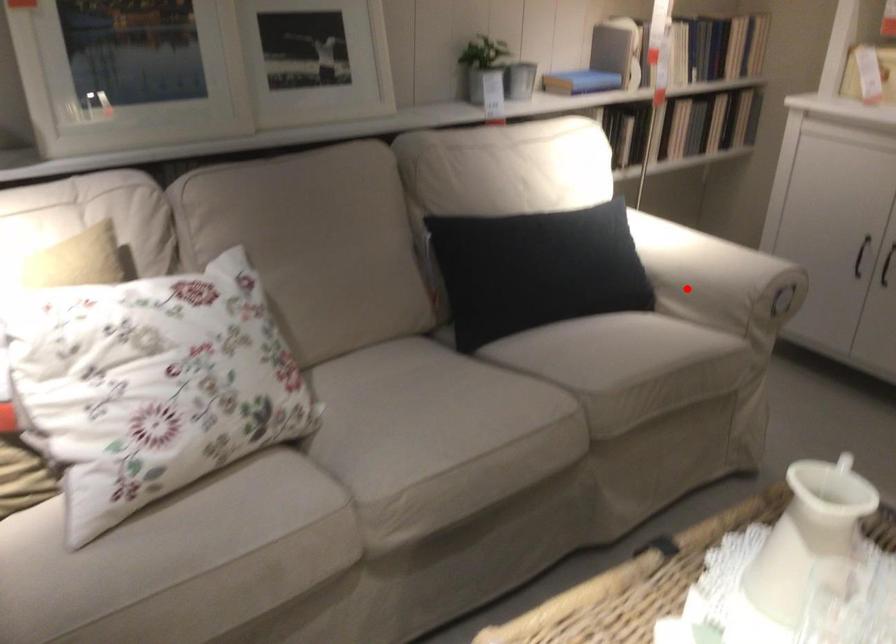
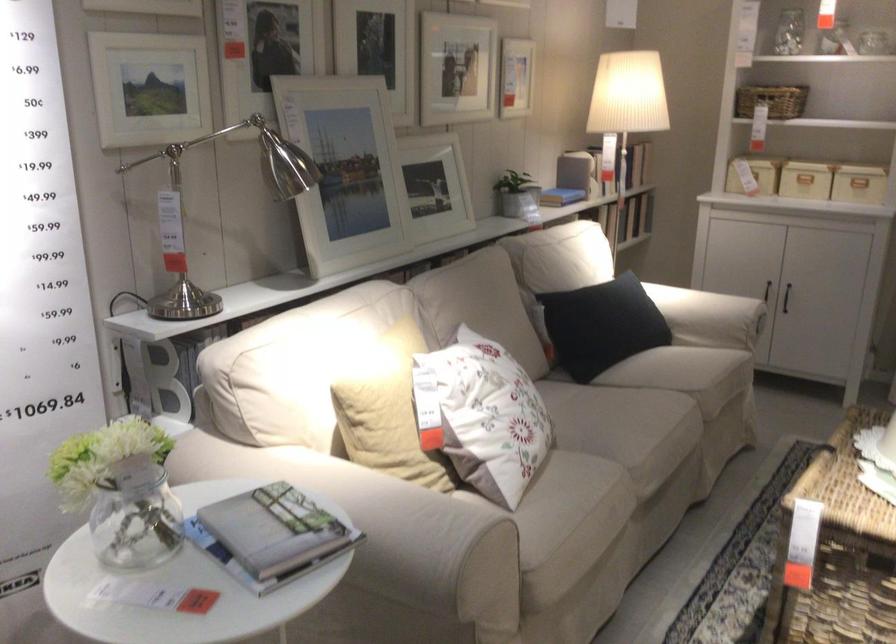
In the second image, find the point that corresponds to the highlighted location in the first image.

(709, 317)